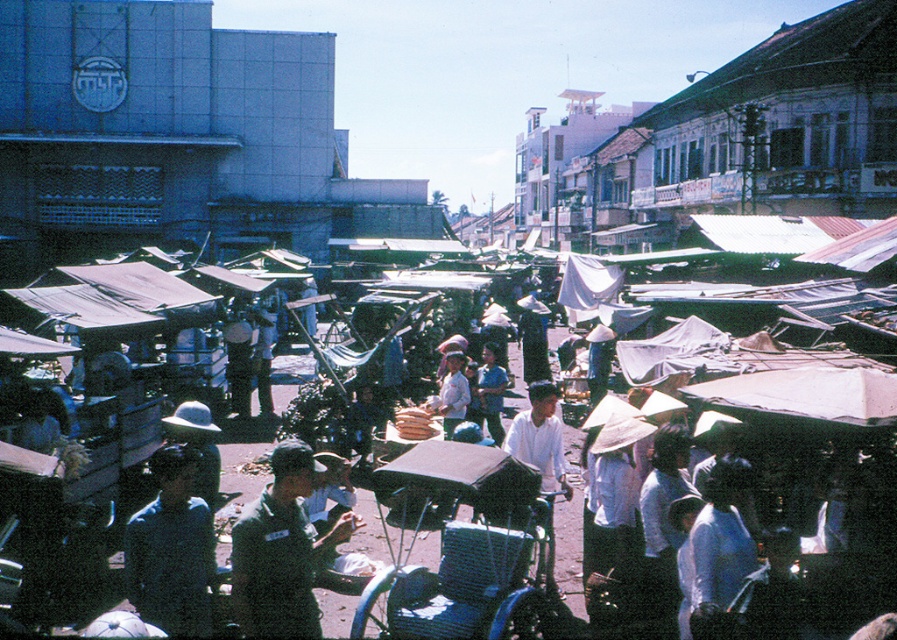
Does white fabric market stalls at center lie in front of dark blue shirt at lower left?

No, white fabric market stalls at center is behind dark blue shirt at lower left.

Is point (843, 624) less distant than point (125, 561)?

No, (843, 624) is behind (125, 561).

Is point (746, 417) in front of point (144, 564)?

That is False.

Locate an element on the screen. Image resolution: width=897 pixels, height=640 pixels. white fabric market stalls at center is located at coordinates (813, 508).

Is the position of dark green uniform at center more distant than that of white cotton shirt at center?

No, dark green uniform at center is closer to the viewer.

The width and height of the screenshot is (897, 640). I want to click on dark green uniform at center, so click(281, 548).

The height and width of the screenshot is (640, 897). Find the location of `dark green uniform at center`. dark green uniform at center is located at coordinates (281, 548).

Can you confirm if dark blue shirt at lower left is bigger than white matte shirt at center?

Actually, dark blue shirt at lower left might be smaller than white matte shirt at center.

Is dark blue shirt at lower left above white matte shirt at center?

Yes, dark blue shirt at lower left is above white matte shirt at center.

Where is `dark blue shirt at lower left`? dark blue shirt at lower left is located at coordinates (171, 548).